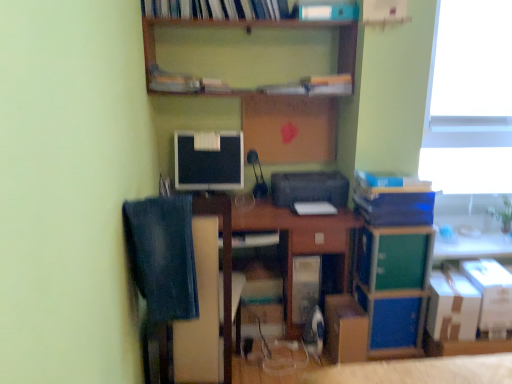
Question: Should I look upward or downward to see blue matte book at upper right, the 1th book from the right?

Choices:
 (A) up
 (B) down

Answer: (A)

Question: Is white cardboard box at lower right, the third cardboard box positioned from the left, at the left side of green matte cabinet at lower right?

Choices:
 (A) yes
 (B) no

Answer: (B)

Question: From a real-world perspective, is white cardboard box at lower right, arranged as the first cardboard box when viewed from the right, over green matte cabinet at lower right?

Choices:
 (A) yes
 (B) no

Answer: (B)

Question: From a real-world perspective, is white cardboard box at lower right, arranged as the first cardboard box when viewed from the right, positioned under green matte cabinet at lower right based on gravity?

Choices:
 (A) yes
 (B) no

Answer: (A)

Question: Is white cardboard box at lower right, the third cardboard box positioned from the left, not inside green matte cabinet at lower right?

Choices:
 (A) yes
 (B) no

Answer: (A)

Question: Considering the relative sizes of white cardboard box at lower right, arranged as the first cardboard box when viewed from the right, and green matte cabinet at lower right in the image provided, is white cardboard box at lower right, arranged as the first cardboard box when viewed from the right, bigger than green matte cabinet at lower right?

Choices:
 (A) no
 (B) yes

Answer: (B)

Question: Is white cardboard box at lower right, arranged as the first cardboard box when viewed from the right, wider than green matte cabinet at lower right?

Choices:
 (A) yes
 (B) no

Answer: (B)

Question: Does denim at left have a greater width compared to green matte cabinet at lower right?

Choices:
 (A) yes
 (B) no

Answer: (A)

Question: Is denim at left looking in the opposite direction of green matte cabinet at lower right?

Choices:
 (A) yes
 (B) no

Answer: (B)

Question: Can you confirm if denim at left is shorter than green matte cabinet at lower right?

Choices:
 (A) yes
 (B) no

Answer: (B)

Question: Does denim at left have a lesser width compared to green matte cabinet at lower right?

Choices:
 (A) no
 (B) yes

Answer: (A)

Question: Is denim at left next to green matte cabinet at lower right?

Choices:
 (A) yes
 (B) no

Answer: (B)

Question: Considering the relative sizes of denim at left and green matte cabinet at lower right in the image provided, is denim at left smaller than green matte cabinet at lower right?

Choices:
 (A) no
 (B) yes

Answer: (A)

Question: From the image's perspective, is blue cardboard book at right, which appears as the 1th book when ordered from the bottom, located beneath satin black monitor at center?

Choices:
 (A) no
 (B) yes

Answer: (B)